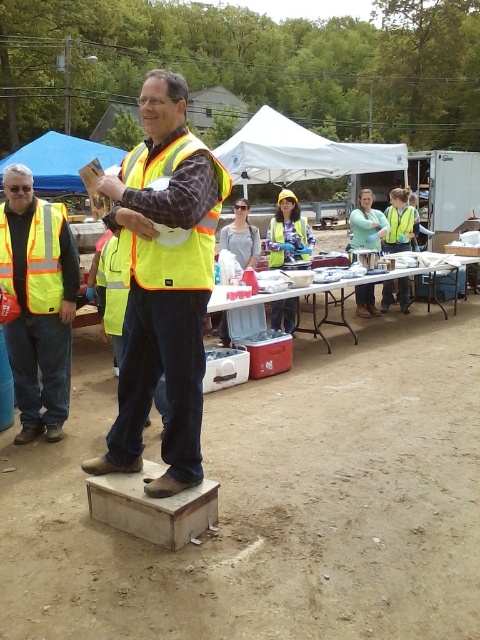
Question: Is high-visibility yellow safety vest at center to the left of yellow reflective safety vest at center from the viewer's perspective?

Choices:
 (A) no
 (B) yes

Answer: (B)

Question: Which of the following is the closest to the observer?

Choices:
 (A) blue fabric canopy at upper left
 (B) high visibility vest at left
 (C) high-visibility yellow safety vest at center

Answer: (C)

Question: Considering the relative positions of high visibility reflective safety vest at left and yellow reflective safety vest at center in the image provided, where is high visibility reflective safety vest at left located with respect to yellow reflective safety vest at center?

Choices:
 (A) left
 (B) right

Answer: (A)

Question: Can you confirm if high visibility vest at left is positioned above blue fabric canopy at upper left?

Choices:
 (A) yes
 (B) no

Answer: (B)

Question: Which point is farther from the camera taking this photo?

Choices:
 (A) (400, 230)
 (B) (40, 220)
 (C) (60, 273)
 (D) (148, 138)

Answer: (A)

Question: Estimate the real-world distances between objects in this image. Which object is farther from the high visibility vest at left?

Choices:
 (A) high visibility reflective safety vest at left
 (B) yellow reflective safety vest at center
 (C) yellow reflective vest at center

Answer: (B)